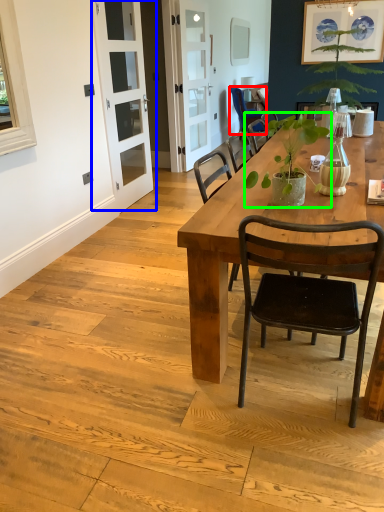
Question: Based on their relative distances, which object is farther from chair (highlighted by a red box)? Choose from screen door (highlighted by a blue box) and houseplant (highlighted by a green box).

Choices:
 (A) screen door
 (B) houseplant

Answer: (B)